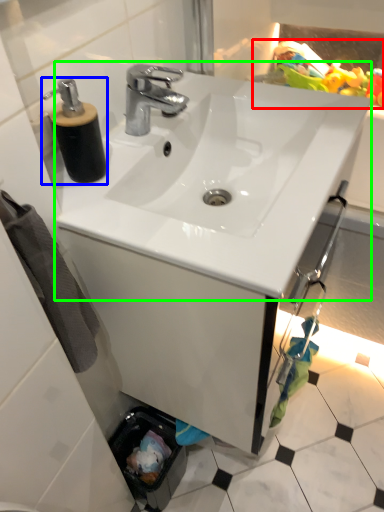
Question: Based on their relative distances, which object is nearer to toy (highlighted by a red box)? Choose from soap dispenser (highlighted by a blue box) and sink (highlighted by a green box).

Choices:
 (A) soap dispenser
 (B) sink

Answer: (B)